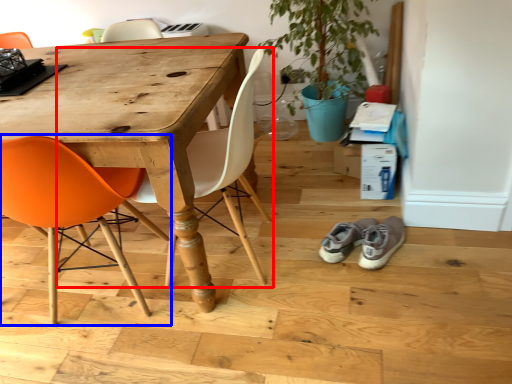
Question: Which object is closer to the camera taking this photo, chair (highlighted by a red box) or chair (highlighted by a blue box)?

Choices:
 (A) chair
 (B) chair

Answer: (B)